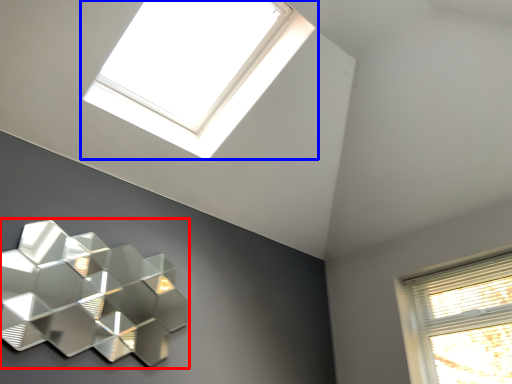
Question: Which object is closer to the camera taking this photo, lamp (highlighted by a red box) or window (highlighted by a blue box)?

Choices:
 (A) lamp
 (B) window

Answer: (A)